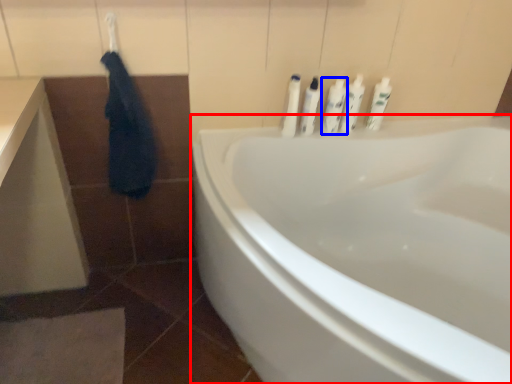
Question: Which of the following is the farthest to the observer, bathtub (highlighted by a red box) or toiletry (highlighted by a blue box)?

Choices:
 (A) bathtub
 (B) toiletry

Answer: (B)